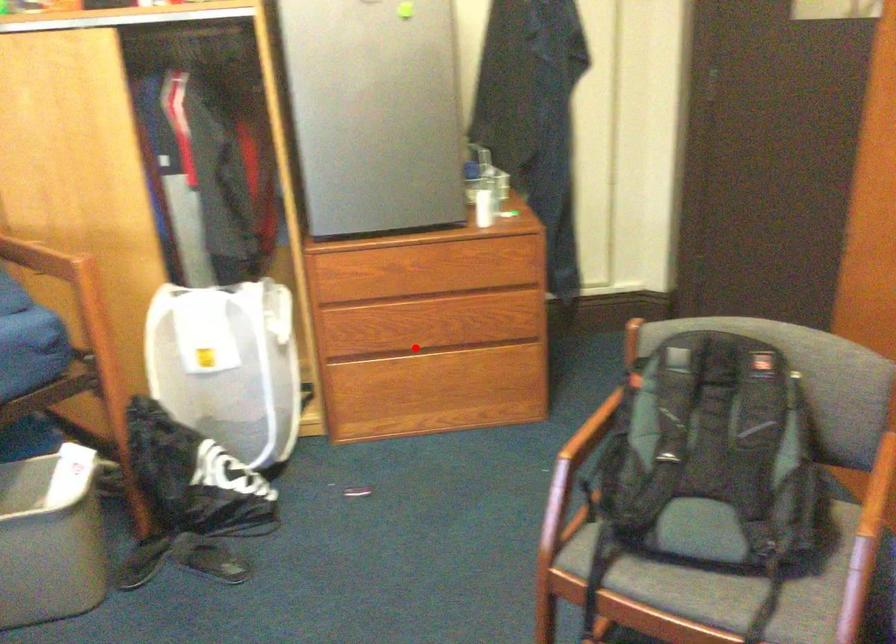
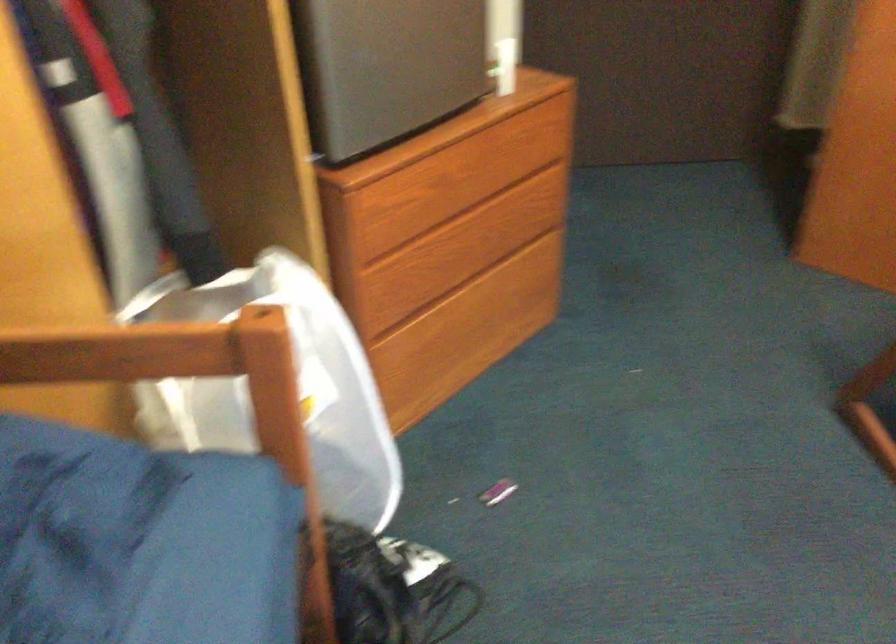
Question: I am providing you with two images of the same scene from different viewpoints. Given a red point in image1, look at the same physical point in image2. Is it:

Choices:
 (A) Closer to the viewpoint
 (B) Farther from the viewpoint

Answer: (A)